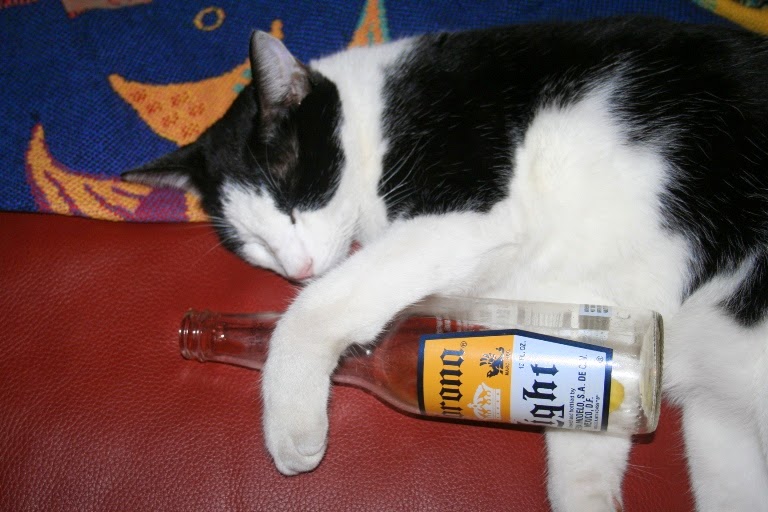
Image resolution: width=768 pixels, height=512 pixels. I want to click on couch, so click(x=118, y=323).